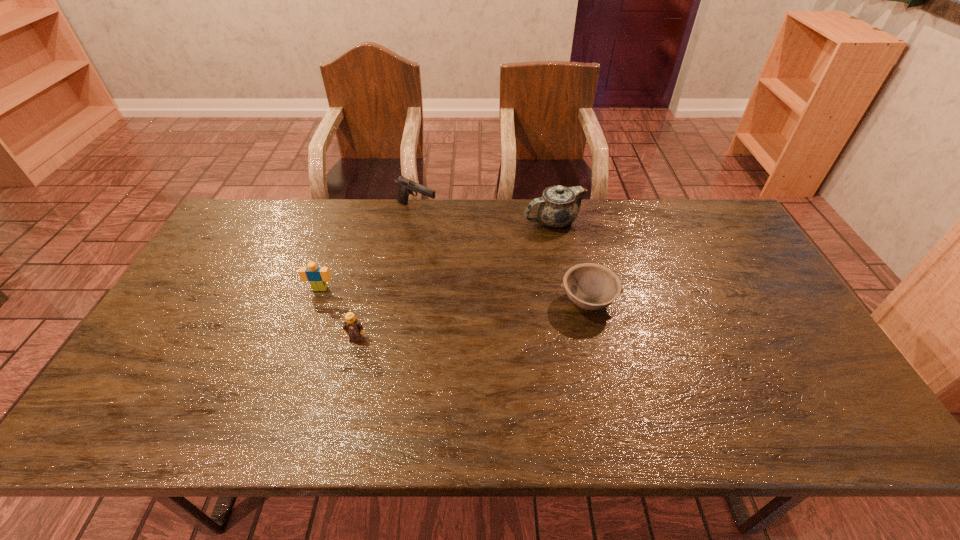
Locate an element on the screen. The width and height of the screenshot is (960, 540). vacant space at the near right corner is located at coordinates (825, 421).

What are the coordinates of `vacant area that lies between the nearest object and the left Lego` in the screenshot? It's located at (338, 313).

Find the location of a particular element. blank region between the nearer Lego and the tallest object is located at coordinates (455, 280).

Where is `vacant point located between the left Lego and the chinaware`? The width and height of the screenshot is (960, 540). vacant point located between the left Lego and the chinaware is located at coordinates (437, 255).

The image size is (960, 540). I want to click on free area in between the gun and the farther Lego, so click(369, 249).

Find the location of a particular element. free space that is in between the chinaware and the farther Lego is located at coordinates (437, 255).

The width and height of the screenshot is (960, 540). Find the location of `free spot between the gun and the nearer Lego`. free spot between the gun and the nearer Lego is located at coordinates (387, 274).

What are the coordinates of `free space between the shortest object and the gun` in the screenshot? It's located at (502, 255).

Locate an element on the screen. The image size is (960, 540). vacant space that's between the gun and the chinaware is located at coordinates (485, 215).

Where is `free spot between the left Lego and the shortest object`? The height and width of the screenshot is (540, 960). free spot between the left Lego and the shortest object is located at coordinates pos(454,295).